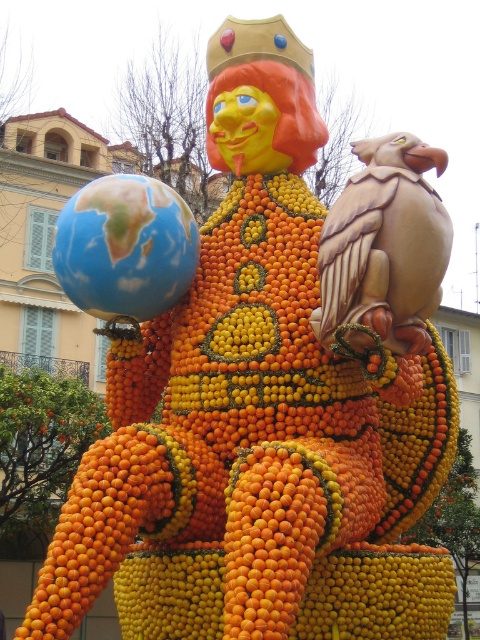
Does blue glossy globe at left have a smaller size compared to orange matte at lower center?

Yes.

Image resolution: width=480 pixels, height=640 pixels. What do you see at coordinates (126, 248) in the screenshot? I see `blue glossy globe at left` at bounding box center [126, 248].

The width and height of the screenshot is (480, 640). What are the coordinates of `blue glossy globe at left` in the screenshot? It's located at (126, 248).

What do you see at coordinates (247, 458) in the screenshot? I see `orange textured globe at left` at bounding box center [247, 458].

Does orange textured globe at left appear on the right side of orange matte at lower center?

No, orange textured globe at left is not to the right of orange matte at lower center.

Is point (255, 502) behind point (349, 628)?

No, it is not.

The height and width of the screenshot is (640, 480). Find the location of `orange textured globe at left`. orange textured globe at left is located at coordinates 247,458.

Which is above, orange textured globe at left or blue glossy globe at left?

blue glossy globe at left is above.

Identify the location of orange textured globe at left. (247, 458).

This screenshot has height=640, width=480. Identify the location of orange textured globe at left. (247, 458).